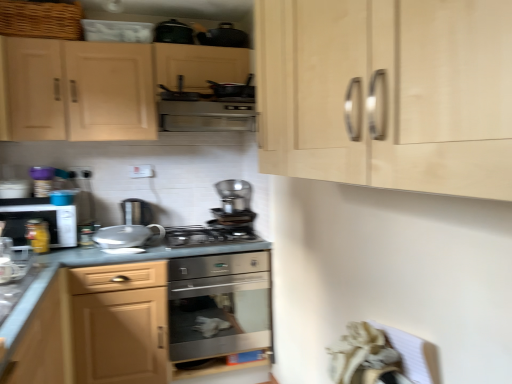
Question: From the image's perspective, is matte wood drawer at lower left, positioned as the 3th cabinetry in top-to-bottom order, located beneath light wood cabinet at upper left, which appears as the first cabinetry when viewed from the top?

Choices:
 (A) no
 (B) yes

Answer: (B)

Question: Considering the relative sizes of matte wood drawer at lower left, positioned as the 3th cabinetry in top-to-bottom order, and light wood cabinet at upper left, the fourth cabinetry positioned from the bottom, in the image provided, is matte wood drawer at lower left, positioned as the 3th cabinetry in top-to-bottom order, bigger than light wood cabinet at upper left, the fourth cabinetry positioned from the bottom,?

Choices:
 (A) no
 (B) yes

Answer: (A)

Question: Is matte wood drawer at lower left, the second cabinetry ordered from the bottom, at the left side of light wood cabinet at upper left, which appears as the first cabinetry when viewed from the top?

Choices:
 (A) yes
 (B) no

Answer: (A)

Question: Considering the relative positions of matte wood drawer at lower left, the second cabinetry ordered from the bottom, and light wood cabinet at upper left, which appears as the first cabinetry when viewed from the top, in the image provided, is matte wood drawer at lower left, the second cabinetry ordered from the bottom, to the right of light wood cabinet at upper left, which appears as the first cabinetry when viewed from the top, from the viewer's perspective?

Choices:
 (A) yes
 (B) no

Answer: (B)

Question: Is light wood cabinet at upper left, which appears as the first cabinetry when viewed from the top, located within matte wood drawer at lower left, the second cabinetry ordered from the bottom?

Choices:
 (A) no
 (B) yes

Answer: (A)

Question: From a real-world perspective, is yellow glass jar at left, which ranks as the 6th appliance in right-to-left order, positioned above or below blue plastic container at left, acting as the fourth appliance starting from the top?

Choices:
 (A) below
 (B) above

Answer: (A)

Question: From the image's perspective, is yellow glass jar at left, the sixth appliance viewed from the top, located above or below blue plastic container at left, which is the 3th appliance from left to right?

Choices:
 (A) above
 (B) below

Answer: (B)

Question: Is yellow glass jar at left, positioned as the 2th appliance in bottom-to-top order, to the left or to the right of blue plastic container at left, the 4th appliance ordered from the bottom, in the image?

Choices:
 (A) right
 (B) left

Answer: (B)

Question: Is yellow glass jar at left, the sixth appliance viewed from the top, inside or outside of blue plastic container at left, which ranks as the 5th appliance in right-to-left order?

Choices:
 (A) inside
 (B) outside

Answer: (B)

Question: Is matte black microwave at left inside or outside of matte white microwave at left, which appears as the 6th appliance when ordered from the bottom?

Choices:
 (A) outside
 (B) inside

Answer: (A)

Question: Based on their positions, is matte black microwave at left located to the left or right of matte white microwave at left, which appears as the 6th appliance when ordered from the bottom?

Choices:
 (A) right
 (B) left

Answer: (A)

Question: Relative to matte white microwave at left, marked as the 2th appliance in a top-to-bottom arrangement, is matte black microwave at left in front or behind?

Choices:
 (A) behind
 (B) front

Answer: (B)

Question: In terms of height, does matte black microwave at left look taller or shorter compared to matte white microwave at left, marked as the 7th appliance in a right-to-left arrangement?

Choices:
 (A) short
 (B) tall

Answer: (B)

Question: Relative to satin wood cabinet at lower center, which ranks as the fourth cabinetry in top-to-bottom order, is stainless steel gas stove at center in front or behind?

Choices:
 (A) front
 (B) behind

Answer: (B)

Question: From the image's perspective, relative to satin wood cabinet at lower center, the first cabinetry when ordered from bottom to top, is stainless steel gas stove at center above or below?

Choices:
 (A) below
 (B) above

Answer: (B)